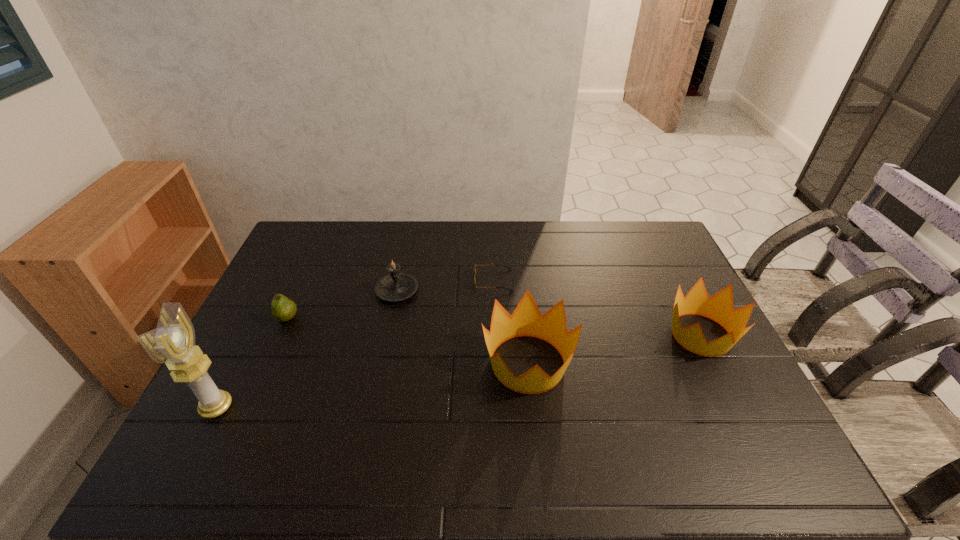
This screenshot has height=540, width=960. I want to click on free space between the leftmost object and the candle, so click(x=307, y=349).

At what (x,y) coordinates should I click in order to perform the action: click on vacant region between the leftmost object and the fifth shortest object. Please return your answer as a coordinate pair (x, y). The width and height of the screenshot is (960, 540). Looking at the image, I should click on (372, 385).

The image size is (960, 540). I want to click on vacant area between the sunglasses and the leftmost object, so [355, 344].

Identify the location of free space between the shorter crown and the taller crown. The image size is (960, 540). (614, 349).

Identify the location of empty location between the candle and the sunglasses. (445, 286).

Image resolution: width=960 pixels, height=540 pixels. I want to click on vacant point located between the left crown and the pear, so click(407, 340).

Where is `free space between the rightmost object and the award`? free space between the rightmost object and the award is located at coordinates (459, 371).

At what (x,y) coordinates should I click in order to perform the action: click on vacant area between the third object from left to right and the taller crown. Please return your answer as a coordinate pair (x, y). The height and width of the screenshot is (540, 960). Looking at the image, I should click on (463, 327).

You are a GUI agent. You are given a task and a screenshot of the screen. Output one action in this format:
    pyautogui.click(x=<x>, y=<y>)
    Task: Click on the object that is the fifth closest to the award
    
    Given the screenshot: What is the action you would take?
    pyautogui.click(x=719, y=307)

Image resolution: width=960 pixels, height=540 pixels. What are the coordinates of `object that is the fourth closest to the right crown` in the screenshot? It's located at (283, 309).